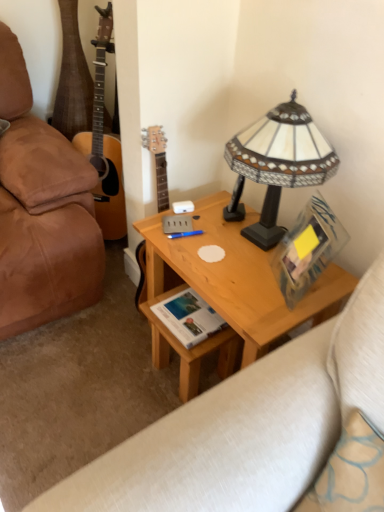
The height and width of the screenshot is (512, 384). I want to click on unoccupied area in front of blue plastic pen at center, so click(201, 259).